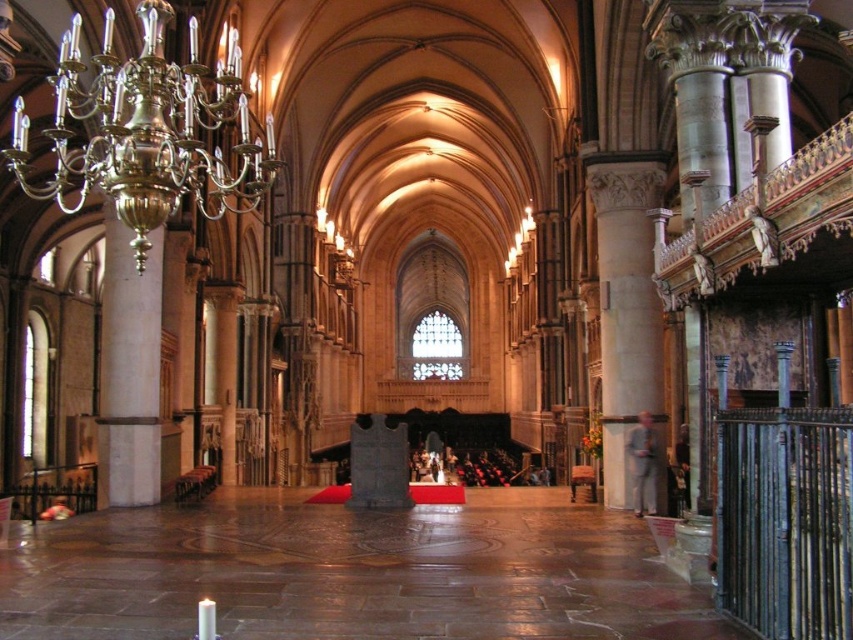
You are standing at point (647, 156) in the cathedral. You want to walk to the entrance, which is located at the opposite end of the cathedral. The entrance is 192.65 feet away from your current position. Can you estimate how long it would take you to walk to the entrance if your walking speed is 3 feet per second?

The entrance is 192.65 feet away from your current position. At a walking speed of 3 feet per second, it would take approximately 64.2 seconds to reach the entrance.

You are planning to install a new lighting fixture in the cathedral. You have a gold polished chandelier at upper left and a polished stone pillar at left. Which object is wider, requiring more horizontal space?

The gold polished chandelier at upper left might be wider than the polished stone pillar at left, so it requires more horizontal space.